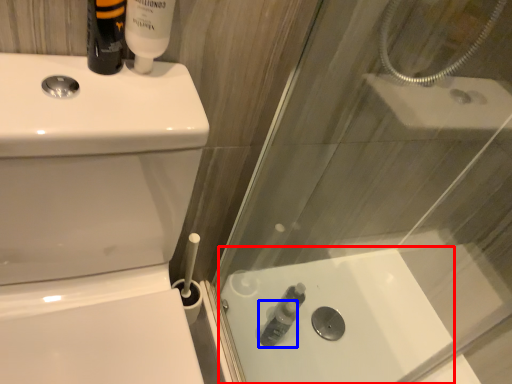
Question: Which object is further to the camera taking this photo, bath (highlighted by a red box) or toiletry (highlighted by a blue box)?

Choices:
 (A) bath
 (B) toiletry

Answer: (B)